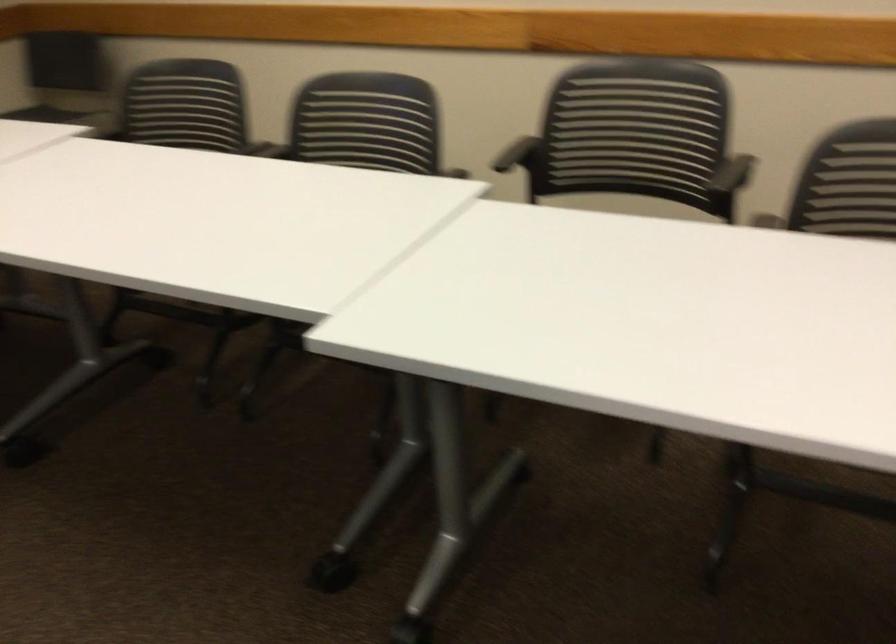
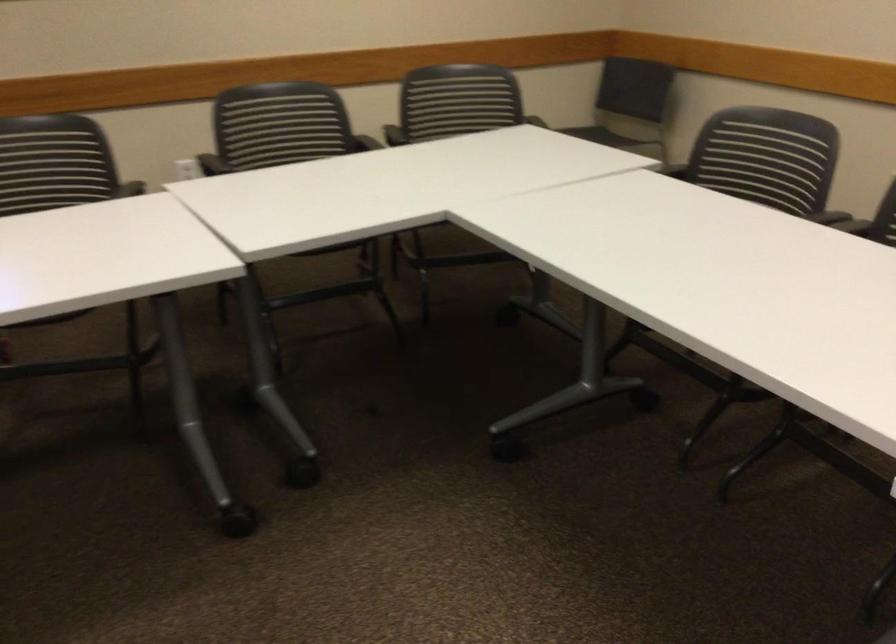
The point at (200, 104) is marked in the first image. Where is the corresponding point in the second image?

(767, 156)